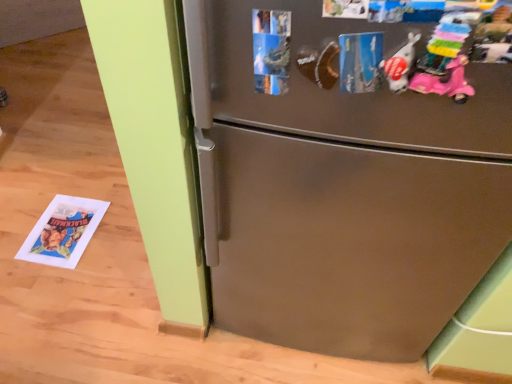
Find the location of a particular element. The height and width of the screenshot is (384, 512). pastel plastic toy at upper right, which is counted as the second toy, starting from the left is located at coordinates (445, 45).

Is pastel plastic toy at upper right, which is counted as the second toy, starting from the left, bigger than stainless steel refrigerator at center?

Actually, pastel plastic toy at upper right, which is counted as the second toy, starting from the left, might be smaller than stainless steel refrigerator at center.

Considering the relative positions of pastel plastic toy at upper right, the 1th toy in the right-to-left sequence, and stainless steel refrigerator at center in the image provided, is pastel plastic toy at upper right, the 1th toy in the right-to-left sequence, to the right of stainless steel refrigerator at center from the viewer's perspective?

Indeed, pastel plastic toy at upper right, the 1th toy in the right-to-left sequence, is positioned on the right side of stainless steel refrigerator at center.

Is pastel plastic toy at upper right, the 1th toy in the right-to-left sequence, looking in the opposite direction of stainless steel refrigerator at center?

pastel plastic toy at upper right, the 1th toy in the right-to-left sequence, is not turned away from stainless steel refrigerator at center.

Looking at this image, from the image's perspective, is pastel plastic toy at upper right, which is counted as the second toy, starting from the left, located above or below stainless steel refrigerator at center?

Clearly, from the image's perspective, pastel plastic toy at upper right, which is counted as the second toy, starting from the left, is above stainless steel refrigerator at center.

How distant is white matte plush toy at upper right, which ranks as the 1th toy in left-to-right order, from pastel plastic toy at upper right, which is counted as the second toy, starting from the left?

1.28 inches.

From the image's perspective, which is below, white matte plush toy at upper right, which is the second toy in right-to-left order, or pastel plastic toy at upper right, the 1th toy in the right-to-left sequence?

white matte plush toy at upper right, which is the second toy in right-to-left order.

Can you tell me how much white matte plush toy at upper right, which is the second toy in right-to-left order, and pastel plastic toy at upper right, the 1th toy in the right-to-left sequence, differ in facing direction?

There is a 0.00734-degree angle between the facing directions of white matte plush toy at upper right, which is the second toy in right-to-left order, and pastel plastic toy at upper right, the 1th toy in the right-to-left sequence.

Which object is thinner, white matte plush toy at upper right, which is the second toy in right-to-left order, or pastel plastic toy at upper right, the 1th toy in the right-to-left sequence?

pastel plastic toy at upper right, the 1th toy in the right-to-left sequence.

Considering the points (407, 81) and (220, 266), which point is behind, point (407, 81) or point (220, 266)?

Point (220, 266)

Which of these two, white matte plush toy at upper right, which ranks as the 1th toy in left-to-right order, or stainless steel refrigerator at center, is wider?

Wider between the two is stainless steel refrigerator at center.

Where is `refrigerator lying behind the white matte plush toy at upper right, which ranks as the 1th toy in left-to-right order`? This screenshot has height=384, width=512. refrigerator lying behind the white matte plush toy at upper right, which ranks as the 1th toy in left-to-right order is located at coordinates (348, 169).

From the image's perspective, is stainless steel refrigerator at center below white matte plush toy at upper right, which ranks as the 1th toy in left-to-right order?

Correct, stainless steel refrigerator at center appears lower than white matte plush toy at upper right, which ranks as the 1th toy in left-to-right order, in the image.

Based on their positions, is stainless steel refrigerator at center located to the left or right of white matte plush toy at upper right, which ranks as the 1th toy in left-to-right order?

Clearly, stainless steel refrigerator at center is on the left of white matte plush toy at upper right, which ranks as the 1th toy in left-to-right order, in the image.

Can you confirm if stainless steel refrigerator at center is smaller than white matte plush toy at upper right, which ranks as the 1th toy in left-to-right order?

Incorrect, stainless steel refrigerator at center is not smaller in size than white matte plush toy at upper right, which ranks as the 1th toy in left-to-right order.

Which is in front, point (220, 95) or point (409, 53)?

The point (409, 53) is closer.

Consider the image. Is stainless steel refrigerator at center oriented away from pastel plastic toy at upper right, the 1th toy in the right-to-left sequence?

stainless steel refrigerator at center does not have its back to pastel plastic toy at upper right, the 1th toy in the right-to-left sequence.

Is stainless steel refrigerator at center to the left of pastel plastic toy at upper right, the 1th toy in the right-to-left sequence, from the viewer's perspective?

Yes.

Considering the sizes of objects stainless steel refrigerator at center and pastel plastic toy at upper right, which is counted as the second toy, starting from the left, in the image provided, who is bigger, stainless steel refrigerator at center or pastel plastic toy at upper right, which is counted as the second toy, starting from the left,?

With larger size is stainless steel refrigerator at center.

Based on the photo, what's the angular difference between stainless steel refrigerator at center and pastel plastic toy at upper right, which is counted as the second toy, starting from the left,'s facing directions?

89.6 degrees.

Is the position of pastel plastic toy at upper right, which is counted as the second toy, starting from the left, more distant than that of white matte plush toy at upper right, which ranks as the 1th toy in left-to-right order?

No, pastel plastic toy at upper right, which is counted as the second toy, starting from the left, is in front of white matte plush toy at upper right, which ranks as the 1th toy in left-to-right order.

From the image's perspective, which is below, pastel plastic toy at upper right, which is counted as the second toy, starting from the left, or white matte plush toy at upper right, which is the second toy in right-to-left order?

white matte plush toy at upper right, which is the second toy in right-to-left order.

Would you say pastel plastic toy at upper right, which is counted as the second toy, starting from the left, is inside or outside white matte plush toy at upper right, which ranks as the 1th toy in left-to-right order?

The correct answer is: outside.

You are a GUI agent. You are given a task and a screenshot of the screen. Output one action in this format:
    pyautogui.click(x=<x>, y=<y>)
    Task: Click on the 2nd toy in front of the stainless steel refrigerator at center
    
    Given the screenshot: What is the action you would take?
    pyautogui.click(x=445, y=45)

Where is `toy lying behind the pastel plastic toy at upper right, which is counted as the second toy, starting from the left`? The width and height of the screenshot is (512, 384). toy lying behind the pastel plastic toy at upper right, which is counted as the second toy, starting from the left is located at coordinates (400, 65).

When comparing their distances from white matte plush toy at upper right, which ranks as the 1th toy in left-to-right order, does pastel plastic toy at upper right, which is counted as the second toy, starting from the left, or stainless steel refrigerator at center seem further?

Among the two, stainless steel refrigerator at center is located further to white matte plush toy at upper right, which ranks as the 1th toy in left-to-right order.

Considering their positions, is white matte plush toy at upper right, which is the second toy in right-to-left order, positioned closer to stainless steel refrigerator at center than pastel plastic toy at upper right, the 1th toy in the right-to-left sequence?

white matte plush toy at upper right, which is the second toy in right-to-left order, is closer to stainless steel refrigerator at center.

Looking at this image, estimate the real-world distances between objects in this image. Which object is further from white matte plush toy at upper right, which is the second toy in right-to-left order, stainless steel refrigerator at center or pastel plastic toy at upper right, which is counted as the second toy, starting from the left?

The object further to white matte plush toy at upper right, which is the second toy in right-to-left order, is stainless steel refrigerator at center.

Considering their positions, is white matte plush toy at upper right, which is the second toy in right-to-left order, positioned closer to pastel plastic toy at upper right, the 1th toy in the right-to-left sequence, than stainless steel refrigerator at center?

The object closer to pastel plastic toy at upper right, the 1th toy in the right-to-left sequence, is white matte plush toy at upper right, which is the second toy in right-to-left order.

Based on their spatial positions, is pastel plastic toy at upper right, the 1th toy in the right-to-left sequence, or white matte plush toy at upper right, which ranks as the 1th toy in left-to-right order, closer to stainless steel refrigerator at center?

white matte plush toy at upper right, which ranks as the 1th toy in left-to-right order.

Estimate the real-world distances between objects in this image. Which object is further from pastel plastic toy at upper right, the 1th toy in the right-to-left sequence, stainless steel refrigerator at center or white matte plush toy at upper right, which is the second toy in right-to-left order?

Among the two, stainless steel refrigerator at center is located further to pastel plastic toy at upper right, the 1th toy in the right-to-left sequence.

Identify the location of toy located between stainless steel refrigerator at center and pastel plastic toy at upper right, the 1th toy in the right-to-left sequence, in the left-right direction. (400, 65).